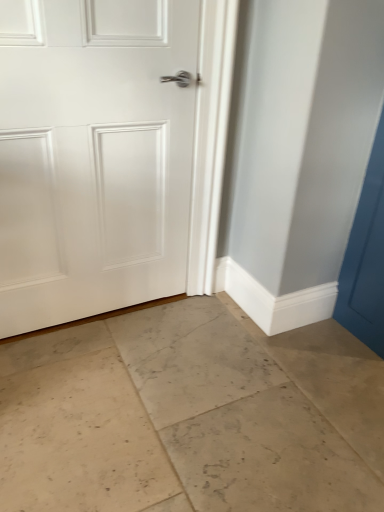
At what (x,y) coordinates should I click in order to perform the action: click on vacant region in front of white matte door at center. Please return your answer as a coordinate pair (x, y). This screenshot has height=512, width=384. Looking at the image, I should click on (96, 391).